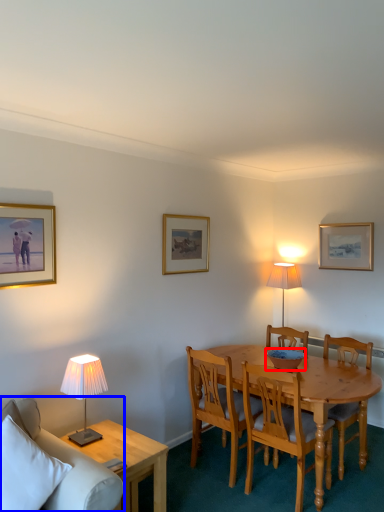
Question: Which object is further to the camera taking this photo, bowl (highlighted by a red box) or studio couch (highlighted by a blue box)?

Choices:
 (A) bowl
 (B) studio couch

Answer: (A)